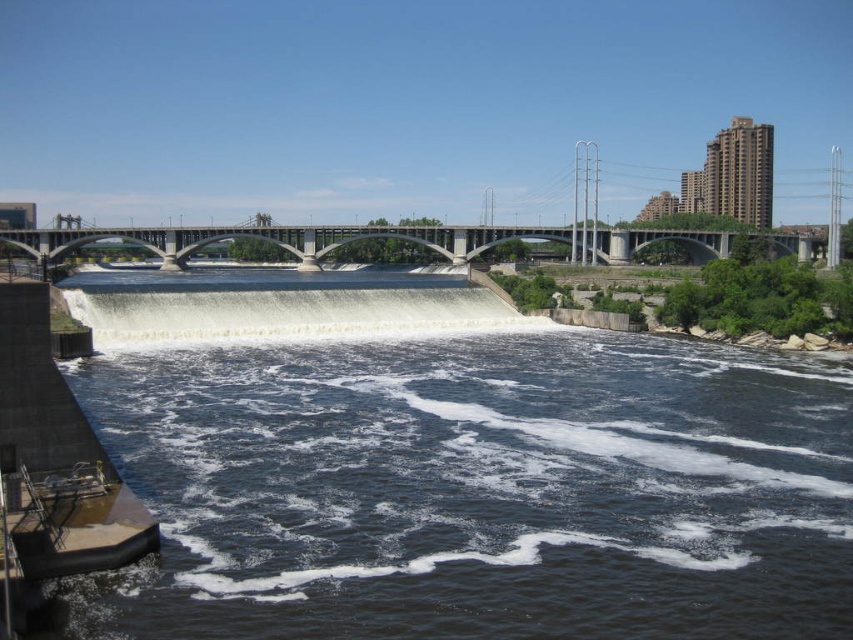
You are a photographer trying to capture the entire scene of the dark blue water at lower left and the concrete bridge at center in one shot. Considering their sizes, which object will occupy more of the frame?

The concrete bridge at center occupies more of the frame because it is larger than the dark blue water at lower left.

You are a drone operator planning to fly a drone over the river scene. The drone has a maximum flight range of 300 feet. If you are positioned at the dark blue water at lower left, can you safely fly the drone to the concrete bridge at center without exceeding its range?

The dark blue water at lower left is 298.33 feet from the concrete bridge at center. Since the drone has a maximum range of 300 feet, it can safely fly from the dark blue water at lower left to the concrete bridge at center as the distance is within the drone operator range.